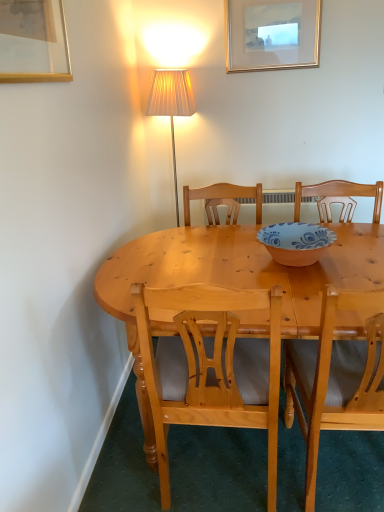
Question: Which direction should I rotate to look at light wood chair at center, which is the first chair from right to left, — up or down?

Choices:
 (A) up
 (B) down

Answer: (B)

Question: Is light wood chair at center, which is the 2th chair in right-to-left order, at the left side of light wood chair at center, positioned as the 2th chair in left-to-right order?

Choices:
 (A) no
 (B) yes

Answer: (B)

Question: From the image's perspective, is light wood chair at center, which is the 2th chair in right-to-left order, above light wood chair at center, positioned as the 2th chair in left-to-right order?

Choices:
 (A) no
 (B) yes

Answer: (A)

Question: Is light wood chair at center, which is the 2th chair in right-to-left order, positioned behind light wood chair at center, positioned as the 2th chair in left-to-right order?

Choices:
 (A) yes
 (B) no

Answer: (A)

Question: Is light wood chair at center, which is the first chair from right to left, inside light wood chair at center, which is the 2th chair in right-to-left order?

Choices:
 (A) no
 (B) yes

Answer: (A)

Question: Could you tell me if light wood chair at center, acting as the first chair starting from the left, is facing light wood chair at center, positioned as the 2th chair in left-to-right order?

Choices:
 (A) no
 (B) yes

Answer: (A)

Question: From the image's perspective, would you say light wood chair at center, which is the 2th chair in right-to-left order, is shown under light wood chair at center, positioned as the 2th chair in left-to-right order?

Choices:
 (A) yes
 (B) no

Answer: (A)

Question: From a real-world perspective, is gold metallic picture frame at upper center, the first picture frame viewed from the top, positioned over light wood chair at center, which is the first chair from right to left, based on gravity?

Choices:
 (A) no
 (B) yes

Answer: (B)

Question: Is gold metallic picture frame at upper center, marked as the second picture frame in a left-to-right arrangement, closer to the viewer compared to light wood chair at center, positioned as the 2th chair in left-to-right order?

Choices:
 (A) no
 (B) yes

Answer: (A)

Question: From a real-world perspective, is gold metallic picture frame at upper center, which is the 2th picture frame from front to back, positioned under light wood chair at center, positioned as the 2th chair in left-to-right order, based on gravity?

Choices:
 (A) yes
 (B) no

Answer: (B)

Question: Considering the relative sizes of gold metallic picture frame at upper center, marked as the second picture frame in a left-to-right arrangement, and light wood chair at center, which is the first chair from right to left, in the image provided, is gold metallic picture frame at upper center, marked as the second picture frame in a left-to-right arrangement, bigger than light wood chair at center, which is the first chair from right to left,?

Choices:
 (A) yes
 (B) no

Answer: (B)

Question: Does gold metallic picture frame at upper center, marked as the second picture frame in a left-to-right arrangement, have a greater width compared to light wood chair at center, which is the first chair from right to left?

Choices:
 (A) no
 (B) yes

Answer: (A)

Question: From the image's perspective, is gold metallic picture frame at upper center, the first picture frame viewed from the top, beneath light wood chair at center, positioned as the 2th chair in left-to-right order?

Choices:
 (A) no
 (B) yes

Answer: (A)

Question: Does light wood chair at center, positioned as the 2th chair in left-to-right order, have a lesser height compared to gold-framed picture at upper left, which is the 1th picture frame from left to right?

Choices:
 (A) no
 (B) yes

Answer: (A)